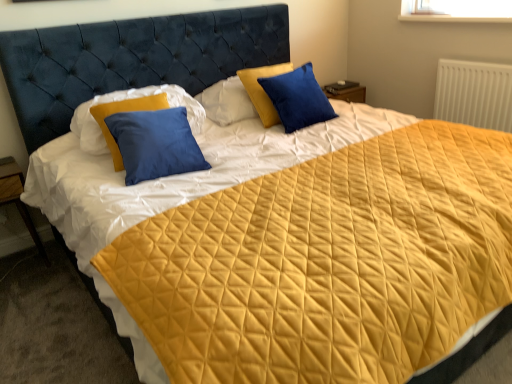
Question: Relative to blue velvet pillow at upper center, which ranks as the 1th pillow in right-to-left order, is wooden at left in front or behind?

Choices:
 (A) behind
 (B) front

Answer: (B)

Question: Does point (31, 233) appear closer or farther from the camera than point (321, 104)?

Choices:
 (A) farther
 (B) closer

Answer: (A)

Question: Estimate the real-world distances between objects in this image. Which object is closer to the white textured radiator at upper right?

Choices:
 (A) matte blue pillow at center, the second pillow from the right
 (B) blue velvet pillow at upper center, which ranks as the 1th pillow in right-to-left order
 (C) wooden at left

Answer: (B)

Question: Considering the real-world distances, which object is farthest from the matte blue pillow at center, the second pillow from the right?

Choices:
 (A) wooden at left
 (B) blue velvet pillow at upper center, which is counted as the second pillow, starting from the left
 (C) white textured radiator at upper right

Answer: (C)